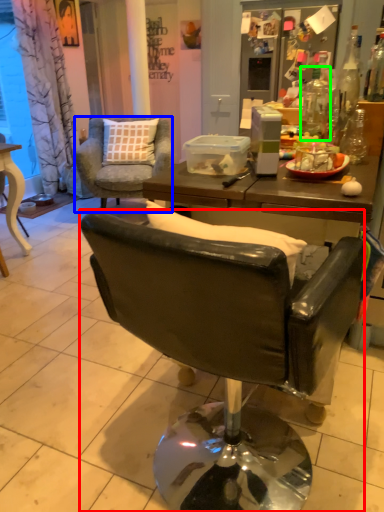
Question: Which is nearer to the chair (highlighted by a red box)? chair (highlighted by a blue box) or bottle (highlighted by a green box).

Choices:
 (A) chair
 (B) bottle

Answer: (B)